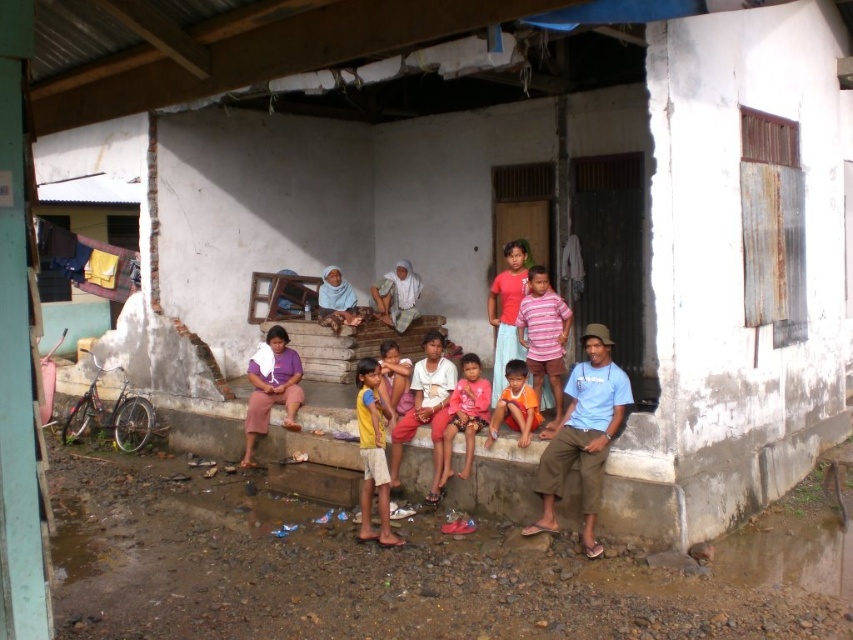
Does matte blue shirt at center have a greater width compared to yellow cotton shirt at center?

Yes, matte blue shirt at center is wider than yellow cotton shirt at center.

Between matte blue shirt at center and yellow cotton shirt at center, which one is positioned lower?

Positioned lower is yellow cotton shirt at center.

Between point (434, 483) and point (363, 536), which one is positioned behind?

Positioned behind is point (434, 483).

Locate an element on the screen. The width and height of the screenshot is (853, 640). matte blue shirt at center is located at coordinates (587, 432).

Is striped cotton shirt at center bigger than orange cotton shirt at center?

Correct, striped cotton shirt at center is larger in size than orange cotton shirt at center.

Does striped cotton shirt at center have a greater height compared to orange cotton shirt at center?

Yes.

This screenshot has height=640, width=853. In order to click on striped cotton shirt at center in this screenshot , I will do `click(544, 336)`.

Who is positioned more to the left, matte pink shirt at center or orange cotton shirt at center?

From the viewer's perspective, matte pink shirt at center appears more on the left side.

Is matte pink shirt at center wider than orange cotton shirt at center?

No.

What do you see at coordinates (465, 413) in the screenshot? I see `matte pink shirt at center` at bounding box center [465, 413].

The image size is (853, 640). What are the coordinates of `matte pink shirt at center` in the screenshot? It's located at (465, 413).